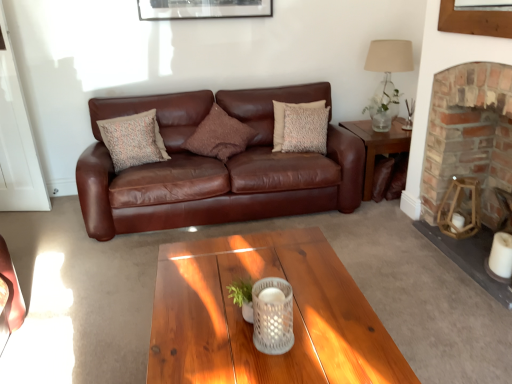
Describe the element at coordinates (202, 9) in the screenshot. This screenshot has width=512, height=384. I see `metallic silver picture frame at upper center` at that location.

The image size is (512, 384). What do you see at coordinates (377, 145) in the screenshot?
I see `wooden side table at right` at bounding box center [377, 145].

This screenshot has width=512, height=384. What do you see at coordinates (469, 136) in the screenshot? I see `brick fireplace at right` at bounding box center [469, 136].

Identify the location of metallic silver picture frame at upper center. (202, 9).

Which point is more distant from viewer, (130, 138) or (399, 126)?

The point (399, 126) is behind.

From the image's perspective, between textured beige pillow at center, positioned as the third pillow in right-to-left order, and wooden side table at right, who is located below?

wooden side table at right.

Is textured beige pillow at center, positioned as the third pillow in right-to-left order, oriented towards wooden side table at right?

No, textured beige pillow at center, positioned as the third pillow in right-to-left order, is not aimed at wooden side table at right.

This screenshot has width=512, height=384. I want to click on pillow that is the 1st one when counting upward from the wooden side table at right (from the image's perspective), so click(x=133, y=140).

Is beige textured pillow at center, which is the 1th pillow in right-to-left order, at the back of translucent glass lamp at upper right?

translucent glass lamp at upper right does not have its back to beige textured pillow at center, which is the 1th pillow in right-to-left order.

Is translucent glass lamp at upper right beside beige textured pillow at center, which is the 1th pillow in right-to-left order?

No, translucent glass lamp at upper right is not making contact with beige textured pillow at center, which is the 1th pillow in right-to-left order.

Would you say translucent glass lamp at upper right is to the left or to the right of beige textured pillow at center, which is the 1th pillow in right-to-left order, in the picture?

translucent glass lamp at upper right is to the right of beige textured pillow at center, which is the 1th pillow in right-to-left order.

Does translucent glass lamp at upper right have a greater height compared to beige textured pillow at center, which is the 1th pillow in right-to-left order?

Yes, translucent glass lamp at upper right is taller than beige textured pillow at center, which is the 1th pillow in right-to-left order.

Is point (252, 7) closer or farther from the camera than point (157, 161)?

Point (252, 7) is positioned farther from the camera compared to point (157, 161).

Identify the location of pillow that is the 3rd object located in front of the metallic silver picture frame at upper center. The image size is (512, 384). (133, 140).

Is the depth of metallic silver picture frame at upper center less than that of textured beige pillow at center, positioned as the third pillow in right-to-left order?

No, metallic silver picture frame at upper center is further to the viewer.

From a real-world perspective, is metallic silver picture frame at upper center on top of textured beige pillow at center, positioned as the third pillow in right-to-left order?

Yes, from a real-world perspective, metallic silver picture frame at upper center is above textured beige pillow at center, positioned as the third pillow in right-to-left order.

Is the position of wooden side table at right more distant than that of brown textured pillow at center, placed as the 2th pillow when sorted from left to right?

Yes, the depth of wooden side table at right is greater than that of brown textured pillow at center, placed as the 2th pillow when sorted from left to right.

Starting from the wooden side table at right, which pillow is the 2nd one to the left? Please provide its 2D coordinates.

[(219, 135)]

From a real-world perspective, is wooden side table at right positioned above or below brown textured pillow at center, placed as the 2th pillow when sorted from left to right?

From a real-world perspective, wooden side table at right is physically below brown textured pillow at center, placed as the 2th pillow when sorted from left to right.

Is point (385, 136) less distant than point (225, 133)?

No, (385, 136) is further to viewer.

Is brick fireplace at right further to camera compared to wooden side table at right?

That is False.

Considering the points (465, 126) and (401, 131), which point is behind, point (465, 126) or point (401, 131)?

The point (401, 131) is farther from the camera.

Which of these two, brick fireplace at right or wooden side table at right, is smaller?

wooden side table at right.

How distant is metallic silver picture frame at upper center from brick fireplace at right?

metallic silver picture frame at upper center is 1.94 meters from brick fireplace at right.

From a real-world perspective, is metallic silver picture frame at upper center physically above brick fireplace at right?

Yes, from a real-world perspective, metallic silver picture frame at upper center is on top of brick fireplace at right.

In the image, is metallic silver picture frame at upper center on the left side or the right side of brick fireplace at right?

In the image, metallic silver picture frame at upper center appears on the left side of brick fireplace at right.

Which object is further away from the camera, metallic silver picture frame at upper center or brick fireplace at right?

Positioned behind is metallic silver picture frame at upper center.

Does point (274, 107) appear closer or farther from the camera than point (488, 105)?

Point (274, 107) appears to be farther away from the viewer than point (488, 105).

Does beige textured pillow at center, placed as the third pillow when sorted from left to right, turn towards brick fireplace at right?

No, beige textured pillow at center, placed as the third pillow when sorted from left to right, is not aimed at brick fireplace at right.

From the image's perspective, is beige textured pillow at center, placed as the third pillow when sorted from left to right, below brick fireplace at right?

Incorrect, from the image's perspective, beige textured pillow at center, placed as the third pillow when sorted from left to right, is higher than brick fireplace at right.

From a real-world perspective, who is located lower, beige textured pillow at center, placed as the third pillow when sorted from left to right, or brick fireplace at right?

From a 3D spatial view, brick fireplace at right is below.

Which pillow is the 2nd one when counting from the front of the wooden side table at right? Please provide its 2D coordinates.

[(133, 140)]

Image resolution: width=512 pixels, height=384 pixels. I want to click on the 1st pillow below when counting from the translucent glass lamp at upper right (from the image's perspective), so click(283, 119).

Which object lies nearer to the anchor point brown textured pillow at center, positioned as the second pillow in right-to-left order, wooden side table at right or brown leather couch at center?

brown leather couch at center is positioned closer to the anchor brown textured pillow at center, positioned as the second pillow in right-to-left order.

Considering their positions, is metallic silver picture frame at upper center positioned further to beige textured pillow at center, placed as the third pillow when sorted from left to right, than brown leather couch at center?

metallic silver picture frame at upper center lies further to beige textured pillow at center, placed as the third pillow when sorted from left to right, than the other object.

Based on their spatial positions, is brown textured pillow at center, positioned as the second pillow in right-to-left order, or wooden side table at right further from beige textured pillow at center, which is the 1th pillow in right-to-left order?

Among the two, wooden side table at right is located further to beige textured pillow at center, which is the 1th pillow in right-to-left order.

Based on their spatial positions, is brick fireplace at right or textured beige pillow at center, placed as the 1th pillow when sorted from left to right, further from brown textured pillow at center, placed as the 2th pillow when sorted from left to right?

brick fireplace at right is further to brown textured pillow at center, placed as the 2th pillow when sorted from left to right.

Based on their spatial positions, is brick fireplace at right or textured beige pillow at center, positioned as the third pillow in right-to-left order, further from brown leather couch at center?

The object further to brown leather couch at center is brick fireplace at right.

When comparing their distances from wooden side table at right, does metallic silver picture frame at upper center or translucent glass lamp at upper right seem further?

metallic silver picture frame at upper center.

Considering their positions, is translucent glass lamp at upper right positioned closer to brown leather couch at center than brown textured pillow at center, placed as the 2th pillow when sorted from left to right?

Among the two, brown textured pillow at center, placed as the 2th pillow when sorted from left to right, is located nearer to brown leather couch at center.

Based on their spatial positions, is brown leather couch at center or beige textured pillow at center, placed as the third pillow when sorted from left to right, further from brown textured pillow at center, placed as the 2th pillow when sorted from left to right?

The object further to brown textured pillow at center, placed as the 2th pillow when sorted from left to right, is beige textured pillow at center, placed as the third pillow when sorted from left to right.

The height and width of the screenshot is (384, 512). In order to click on lamp between metallic silver picture frame at upper center and brick fireplace at right in the horizontal direction in this screenshot , I will do `click(387, 79)`.

In order to click on lamp between brown textured pillow at center, positioned as the second pillow in right-to-left order, and brick fireplace at right, in the horizontal direction in this screenshot , I will do `click(387, 79)`.

I want to click on studio couch between textured beige pillow at center, positioned as the third pillow in right-to-left order, and brick fireplace at right, in the horizontal direction, so click(x=216, y=167).

The image size is (512, 384). Identify the location of lamp between textured beige pillow at center, positioned as the third pillow in right-to-left order, and brick fireplace at right. (387, 79).